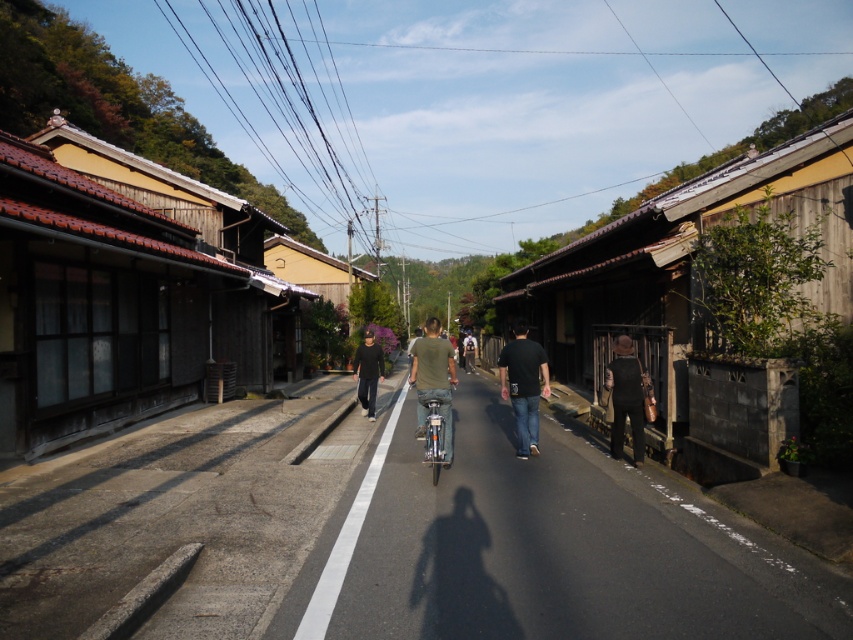
Question: Which of the following is the farthest from the observer?

Choices:
 (A) (364, 332)
 (B) (642, 413)

Answer: (A)

Question: Is dark brown leather jacket at lower right smaller than green matte shirt at center?

Choices:
 (A) no
 (B) yes

Answer: (B)

Question: Does dark brown leather jacket at lower right appear on the right side of dark gray sweater at center?

Choices:
 (A) yes
 (B) no

Answer: (A)

Question: Which point appears farthest from the camera in this image?

Choices:
 (A) pyautogui.click(x=444, y=356)
 (B) pyautogui.click(x=556, y=570)

Answer: (A)

Question: Is smooth asphalt road at center bigger than black matte shirt at center?

Choices:
 (A) no
 (B) yes

Answer: (A)

Question: Which point is closer to the camera taking this photo?

Choices:
 (A) (358, 371)
 (B) (352, 486)
 (C) (427, 371)
 (D) (515, 368)

Answer: (B)